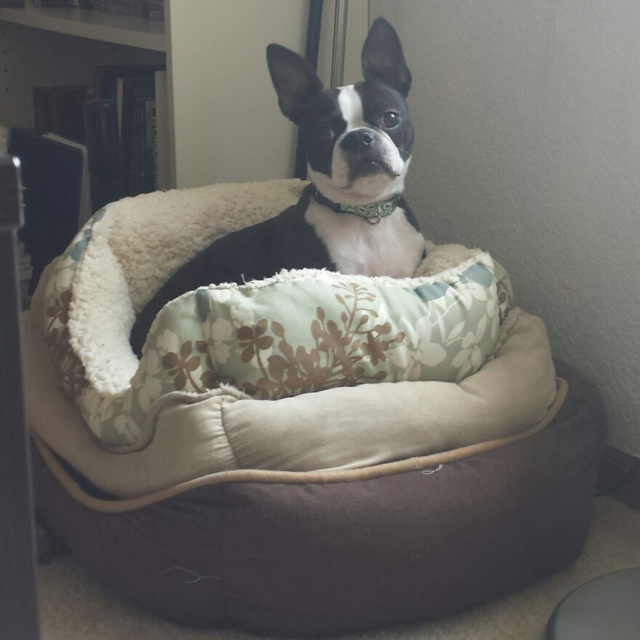
You are a dog owner who wants to place a new dog bed in your living room. The current dog bed is the fluffy beige dog bed at center, and there is a wooden bookshelf at upper left. Which object is taller?

The fluffy beige dog bed at center is taller than the wooden bookshelf at upper left according to the description provided.

You are an interior designer assessing the space. Which object, the wooden bookshelf at upper left or the black and white fur at center, occupies more space in the room?

The wooden bookshelf at upper left is bigger than the black and white fur at center, so it occupies more space in the room.